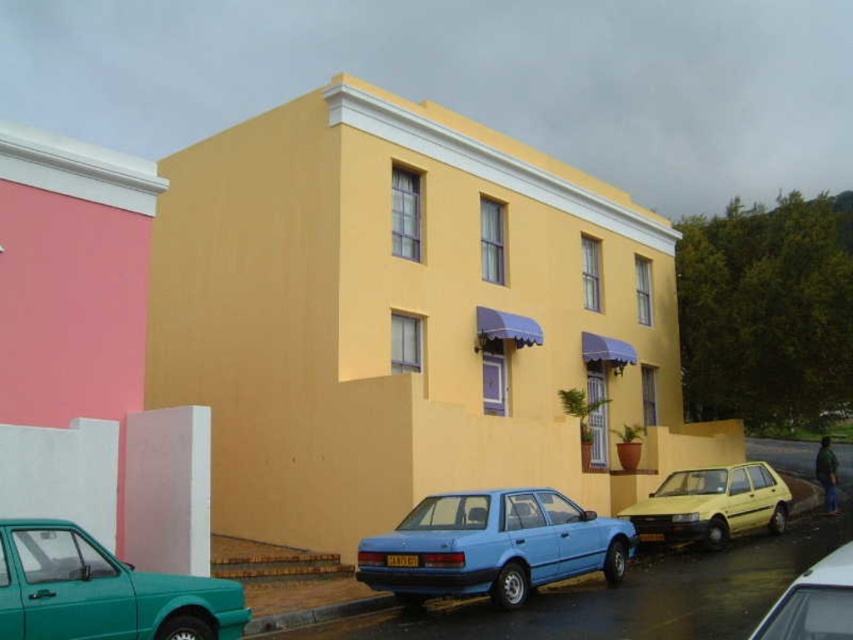
You are standing at the center of the paved area in front of the building. You want to park your teal glossy hatchback at lower left as close as possible to the building without crossing the brick border. Where should you position it?

The teal glossy hatchback at lower left should be positioned at point (102, 592) to park as close as possible to the building without crossing the brick border.

You are a delivery person needing to park your vehicle in the paved area in front of the building. You have a teal glossy hatchback at lower left and a metallic silver car at lower right. Which vehicle would require more space to park properly?

The teal glossy hatchback at lower left requires more space to park properly because it has a larger size compared to the metallic silver car at lower right.

You are a delivery person who needs to park your teal glossy hatchback at lower left near the building. The parking spot is located at coordinates point 0.925, 0.121. Is your current position correct?

Yes, the teal glossy hatchback at lower left is already positioned at point (102, 592), so it is correctly parked at the designated parking spot.